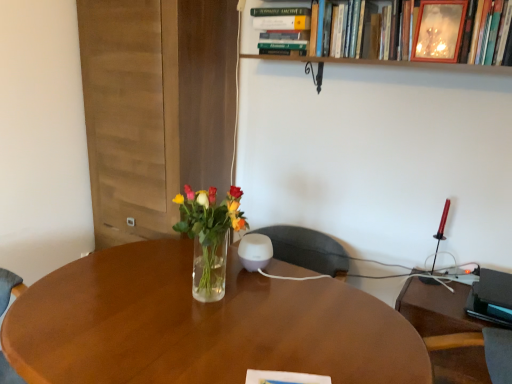
Question: Should I look upward or downward to see wooden frame at upper center, the first book positioned from the right?

Choices:
 (A) down
 (B) up

Answer: (B)

Question: Is black plastic computer desk at right oriented towards hardcover book at upper center, the second book when ordered from right to left?

Choices:
 (A) no
 (B) yes

Answer: (A)

Question: Is black plastic computer desk at right thinner than hardcover book at upper center, acting as the 1th book starting from the left?

Choices:
 (A) no
 (B) yes

Answer: (A)

Question: Is black plastic computer desk at right at the right side of hardcover book at upper center, the second book when ordered from right to left?

Choices:
 (A) yes
 (B) no

Answer: (A)

Question: Considering the relative sizes of black plastic computer desk at right and hardcover book at upper center, acting as the 1th book starting from the left, in the image provided, is black plastic computer desk at right bigger than hardcover book at upper center, acting as the 1th book starting from the left,?

Choices:
 (A) yes
 (B) no

Answer: (A)

Question: From a real-world perspective, is black plastic computer desk at right on top of hardcover book at upper center, the second book when ordered from right to left?

Choices:
 (A) no
 (B) yes

Answer: (A)

Question: Can you confirm if black plastic computer desk at right is taller than hardcover book at upper center, the second book when ordered from right to left?

Choices:
 (A) no
 (B) yes

Answer: (B)

Question: Is translucent glass vase at center surrounded by wooden frame at upper center, the first book positioned from the right?

Choices:
 (A) no
 (B) yes

Answer: (A)

Question: Is wooden frame at upper center, the second book from the left, shorter than translucent glass vase at center?

Choices:
 (A) yes
 (B) no

Answer: (A)

Question: Is wooden frame at upper center, the first book positioned from the right, closer to the viewer compared to translucent glass vase at center?

Choices:
 (A) yes
 (B) no

Answer: (B)

Question: Is wooden frame at upper center, the first book positioned from the right, not inside translucent glass vase at center?

Choices:
 (A) no
 (B) yes

Answer: (B)

Question: Does wooden frame at upper center, the second book from the left, appear on the left side of translucent glass vase at center?

Choices:
 (A) yes
 (B) no

Answer: (B)

Question: Could you tell me if wooden frame at upper center, the second book from the left, is turned towards translucent glass vase at center?

Choices:
 (A) yes
 (B) no

Answer: (B)

Question: Is translucent glass vase at center wider than wooden picture frame at upper right?

Choices:
 (A) no
 (B) yes

Answer: (B)